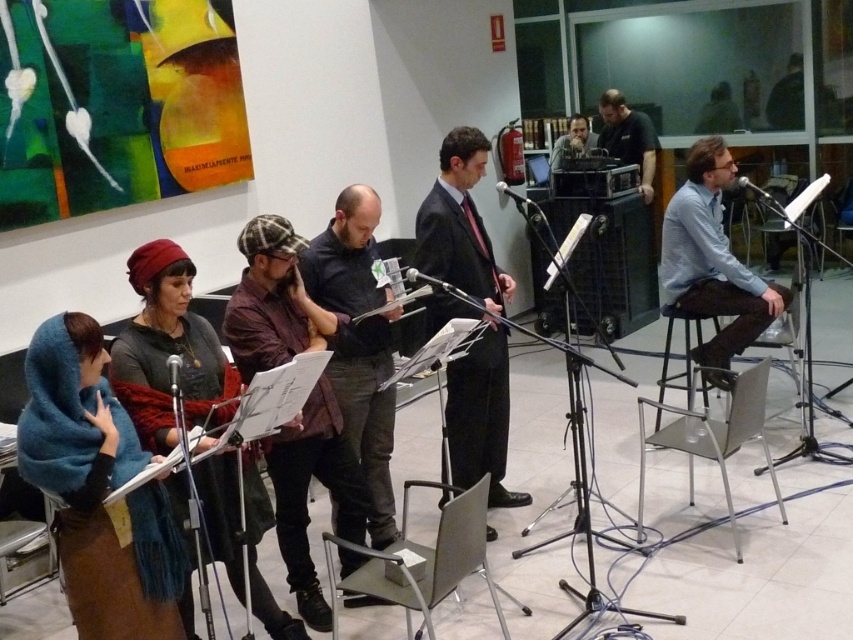
Can you confirm if dark suit at center is positioned to the right of dark green shirt at upper right?

Incorrect, dark suit at center is not on the right side of dark green shirt at upper right.

Where is `dark suit at center`? dark suit at center is located at coordinates (459, 225).

Which of these two, dark suit at center or blue shirt at center, stands taller?

dark suit at center

Which is behind, point (456, 444) or point (786, 300)?

Positioned behind is point (786, 300).

What do you see at coordinates (459, 225) in the screenshot?
I see `dark suit at center` at bounding box center [459, 225].

Identify the location of dark suit at center. (459, 225).

Between blue shirt at center and dark green shirt at upper right, which one appears on the right side from the viewer's perspective?

dark green shirt at upper right is more to the right.

Does point (718, 356) lie behind point (640, 164)?

No.

Locate an element on the screen. The height and width of the screenshot is (640, 853). blue shirt at center is located at coordinates (712, 262).